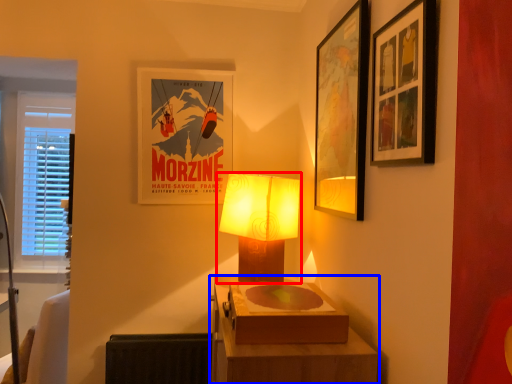
Question: Which of the following is the closest to the observer, lamp (highlighted by a red box) or table (highlighted by a blue box)?

Choices:
 (A) lamp
 (B) table

Answer: (B)